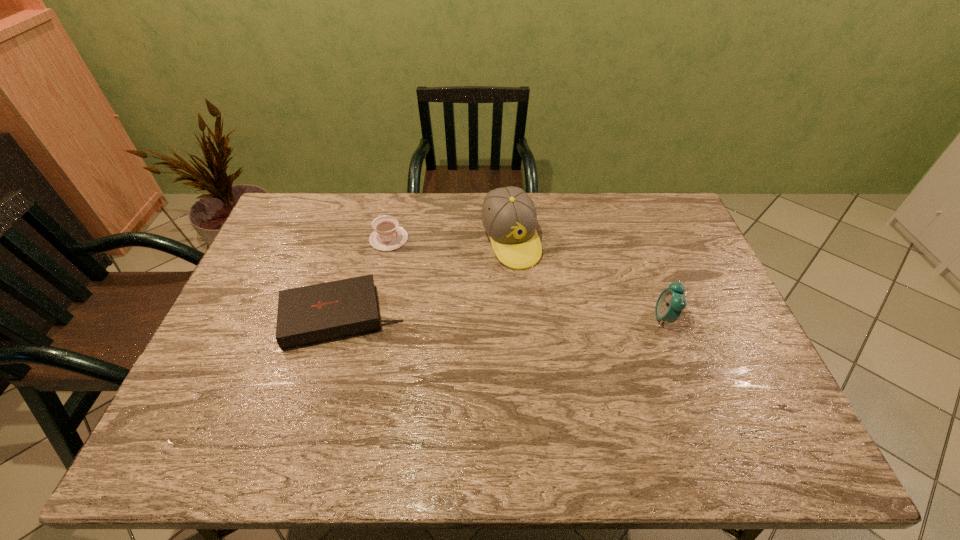
Where is `blank space located on the handle side of the teacup`? blank space located on the handle side of the teacup is located at coordinates (418, 256).

The image size is (960, 540). Find the location of `free space located 0.390m on the handle side of the teacup`. free space located 0.390m on the handle side of the teacup is located at coordinates (494, 303).

This screenshot has width=960, height=540. In order to click on vacant point located on the handle side of the teacup in this screenshot , I will do `click(424, 260)`.

I want to click on vacant space located on the front-facing side of the baseball cap, so click(x=556, y=348).

Locate an element on the screen. vacant space situated 0.210m on the front-facing side of the baseball cap is located at coordinates (543, 320).

Locate an element on the screen. free space located on the front-facing side of the baseball cap is located at coordinates (540, 312).

The height and width of the screenshot is (540, 960). I want to click on teacup that is at the far edge, so click(x=387, y=235).

This screenshot has width=960, height=540. Identify the location of baseball cap at the far edge. (509, 217).

Where is `object at the left edge`? The width and height of the screenshot is (960, 540). object at the left edge is located at coordinates (310, 314).

I want to click on object that is at the right edge, so coord(671,301).